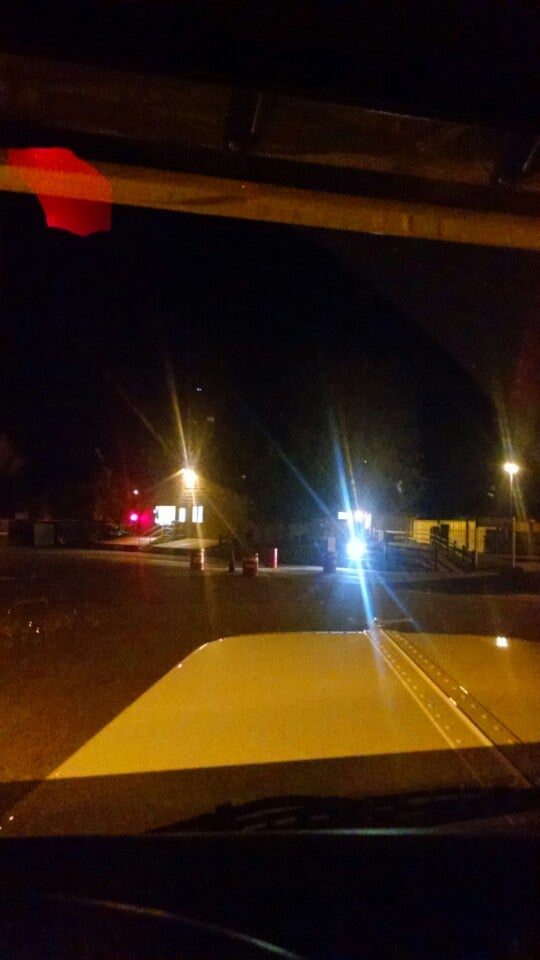
I want to click on window, so click(x=349, y=783).